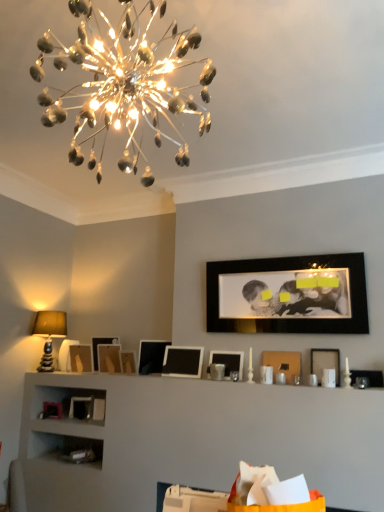
Question: Is matte wooden picture frame at center, which appears as the fourth picture frame when viewed from the left, turned away from matte black picture frame at right, which appears as the twelfth picture frame when viewed from the left?

Choices:
 (A) yes
 (B) no

Answer: (B)

Question: Can you see matte wooden picture frame at center, which appears as the fourth picture frame when viewed from the left, touching matte black picture frame at right, which appears as the twelfth picture frame when viewed from the left?

Choices:
 (A) yes
 (B) no

Answer: (B)

Question: Is matte wooden picture frame at center, which is counted as the ninth picture frame, starting from the right, to the right of matte black picture frame at right, placed as the first picture frame when sorted from right to left, from the viewer's perspective?

Choices:
 (A) yes
 (B) no

Answer: (B)

Question: Is matte black picture frame at right, which appears as the twelfth picture frame when viewed from the left, inside matte wooden picture frame at center, which appears as the fourth picture frame when viewed from the left?

Choices:
 (A) yes
 (B) no

Answer: (B)

Question: Is the position of matte wooden picture frame at center, which is counted as the ninth picture frame, starting from the right, less distant than that of matte black picture frame at right, placed as the first picture frame when sorted from right to left?

Choices:
 (A) no
 (B) yes

Answer: (A)

Question: In terms of width, does shiny metallic chandelier at upper center look wider or thinner when compared to matte wooden picture frame at left, marked as the 2th picture frame in a left-to-right arrangement?

Choices:
 (A) wide
 (B) thin

Answer: (A)

Question: Looking at the image, does shiny metallic chandelier at upper center seem bigger or smaller compared to matte wooden picture frame at left, acting as the 11th picture frame starting from the right?

Choices:
 (A) small
 (B) big

Answer: (B)

Question: Does point (137, 58) appear closer or farther from the camera than point (72, 370)?

Choices:
 (A) farther
 (B) closer

Answer: (B)

Question: From the image's perspective, relative to matte wooden picture frame at left, acting as the 11th picture frame starting from the right, is shiny metallic chandelier at upper center above or below?

Choices:
 (A) below
 (B) above

Answer: (B)

Question: In the image, is shiny metallic chandelier at upper center on the left side or the right side of matte black picture frame at right, which appears as the twelfth picture frame when viewed from the left?

Choices:
 (A) right
 (B) left

Answer: (B)

Question: In the image, is shiny metallic chandelier at upper center positioned in front of or behind matte black picture frame at right, placed as the first picture frame when sorted from right to left?

Choices:
 (A) behind
 (B) front

Answer: (B)

Question: Based on their sizes in the image, would you say shiny metallic chandelier at upper center is bigger or smaller than matte black picture frame at right, placed as the first picture frame when sorted from right to left?

Choices:
 (A) big
 (B) small

Answer: (A)

Question: From the image's perspective, is shiny metallic chandelier at upper center above or below matte black picture frame at right, which appears as the twelfth picture frame when viewed from the left?

Choices:
 (A) below
 (B) above

Answer: (B)

Question: In the image, is black glossy picture frame at upper center, the tenth picture frame when ordered from left to right, positioned in front of or behind black matte picture frame at center, arranged as the 7th picture frame when viewed from the left?

Choices:
 (A) behind
 (B) front

Answer: (B)

Question: In terms of width, does black glossy picture frame at upper center, the third picture frame in the right-to-left sequence, look wider or thinner when compared to black matte picture frame at center, arranged as the 7th picture frame when viewed from the left?

Choices:
 (A) wide
 (B) thin

Answer: (B)